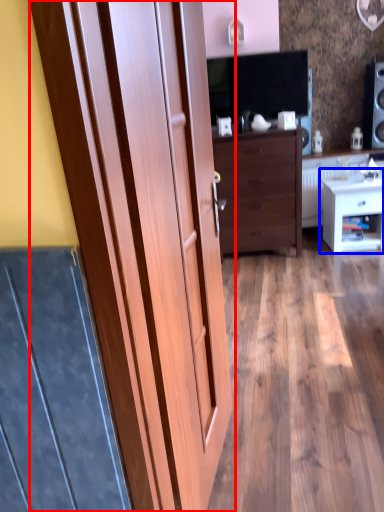
Question: Among these objects, which one is farthest to the camera, door (highlighted by a red box) or nightstand (highlighted by a blue box)?

Choices:
 (A) door
 (B) nightstand

Answer: (B)